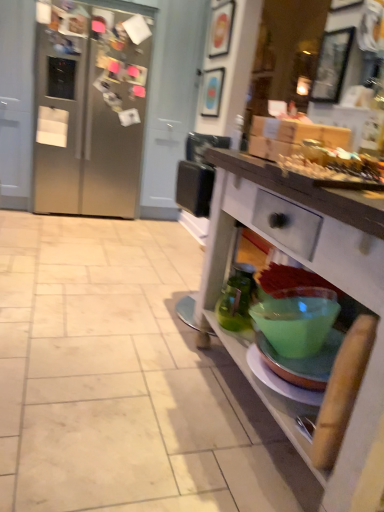
Question: From a real-world perspective, is wooden picture frame at upper center, acting as the 2th picture frame starting from the right, physically located above or below satin silver refrigerator at left?

Choices:
 (A) above
 (B) below

Answer: (A)

Question: Choose the correct answer: Is wooden picture frame at upper center, which is counted as the 2th picture frame, starting from the front, inside satin silver refrigerator at left or outside it?

Choices:
 (A) outside
 (B) inside

Answer: (A)

Question: Which of these objects is positioned farthest from the wooden picture frame at upper right, the first picture frame ordered from the bottom?

Choices:
 (A) wooden picture frame at upper center, the second picture frame from the left
 (B) matte blue picture frame at upper center, the 3th picture frame positioned from the right
 (C) satin silver refrigerator at left

Answer: (C)

Question: Which object is the closest to the wooden picture frame at upper right, placed as the first picture frame when sorted from front to back?

Choices:
 (A) matte blue picture frame at upper center, the 1th picture frame from the back
 (B) wooden picture frame at upper center, which is the second picture frame in back-to-front order
 (C) satin silver refrigerator at left

Answer: (B)